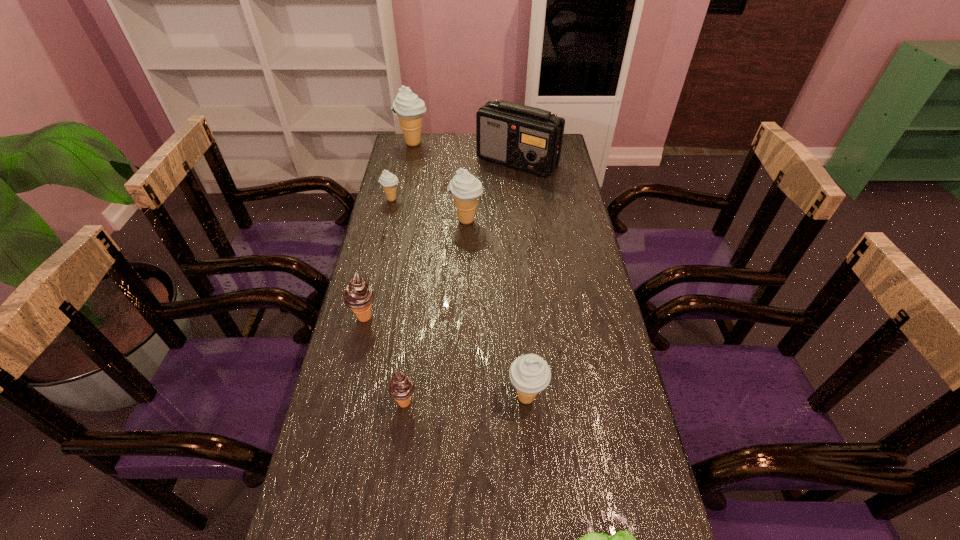
Locate an element on the screen. This screenshot has height=540, width=960. the third closest object to the nearer chocolate icecream is located at coordinates (623, 539).

Locate which icecream is the closest to the fifth object from right to left. Please provide its 2D coordinates. Your answer should be formatted as a tuple, i.e. [(x, y)], where the tuple contains the x and y coordinates of a point satisfying the conditions above.

[(358, 295)]

Locate an element on the screen. Image resolution: width=960 pixels, height=540 pixels. icecream that is the second closest to the radio receiver is located at coordinates (409, 108).

Locate an element on the screen. The width and height of the screenshot is (960, 540). the second closest beige icecream relative to the third nearest icecream is located at coordinates (530, 374).

Where is `the second closest beige icecream to the nearer chocolate icecream`? the second closest beige icecream to the nearer chocolate icecream is located at coordinates (466, 189).

I want to click on free location that satisfies the following two spatial constraints: 1. on the front side of the second tallest icecream; 2. on the right side of the second farthest beige icecream, so click(x=387, y=220).

The image size is (960, 540). What are the coordinates of `blank space that satisfies the following two spatial constraints: 1. on the front side of the rightmost icecream; 2. on the right side of the third nearest beige icecream` in the screenshot? It's located at (346, 397).